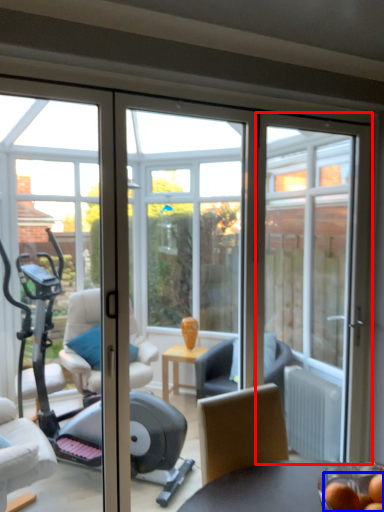
Question: Among these objects, which one is farthest to the camera, door (highlighted by a red box) or food (highlighted by a blue box)?

Choices:
 (A) door
 (B) food

Answer: (A)